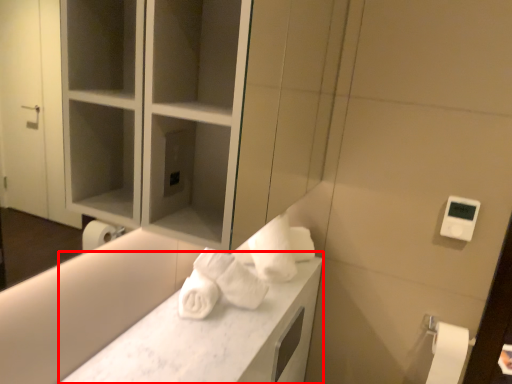
Question: From the image's perspective, where is counter top (annotated by the red box) located in relation to toilet paper in the image?

Choices:
 (A) below
 (B) above

Answer: (B)